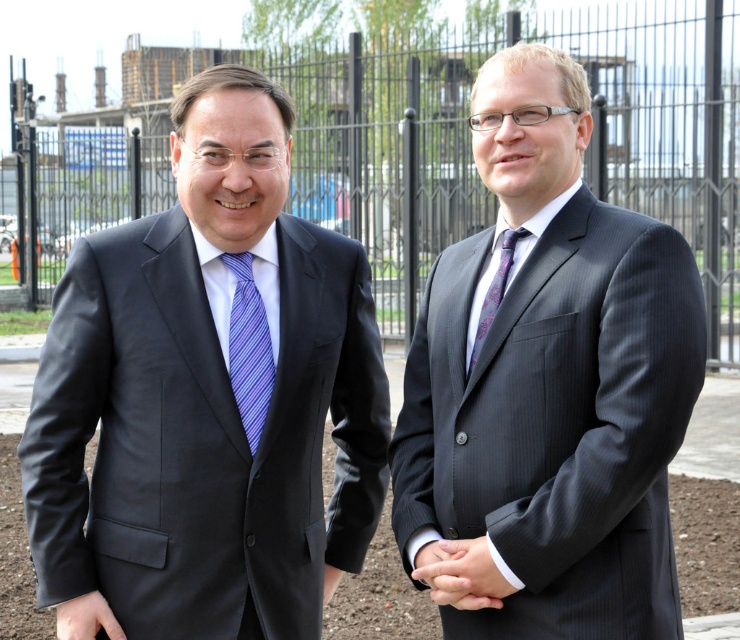
You are an event planner trying to arrange a photo shoot. You need to position the matte black suit at right and the purple silk tie at center in a way that aligns with their current spatial relationship. Which object should be placed lower when setting up the scene?

The matte black suit at right should be placed lower than the purple silk tie at center because the matte black suit at right is below purple silk tie at center in the original image.

Based on the photo, you are a photographer trying to capture a closeup of the man on the left. The camera you are using has a focus point at coordinate point (209, 394). Based on the scene, where is this focus point located on the man?

The focus point at coordinate point (209, 394) is on the matte black suit at left.